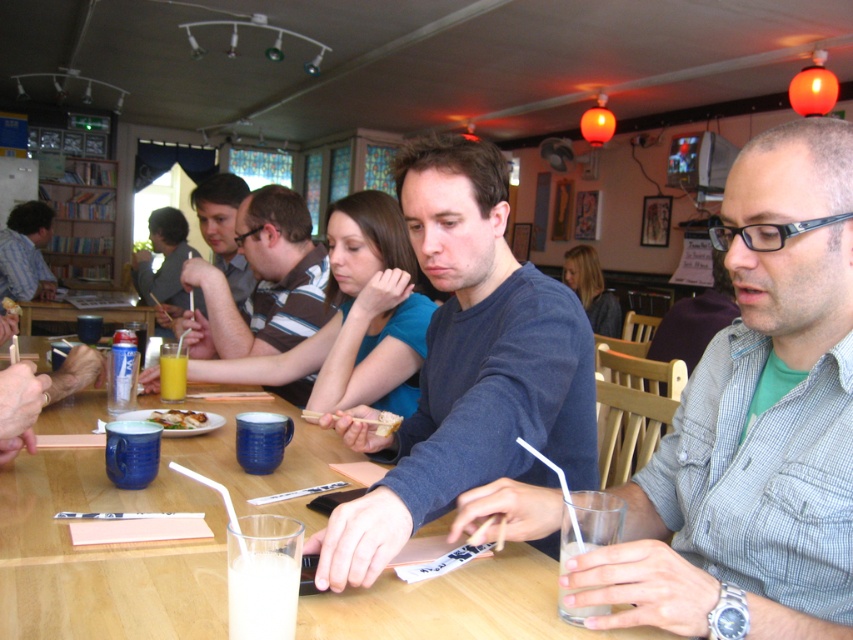
Question: Is wooden table at center closer to the viewer compared to yellow matte cup at center?

Choices:
 (A) yes
 (B) no

Answer: (A)

Question: Is matte black shirt at center smaller than golden fried fish at center?

Choices:
 (A) no
 (B) yes

Answer: (A)

Question: Which point is closer to the camera taking this photo?

Choices:
 (A) (21, 244)
 (B) (189, 413)

Answer: (B)

Question: Which of the following is the farthest from the observer?

Choices:
 (A) wooden table at center
 (B) milky white liquid at lower left

Answer: (A)

Question: Which point appears farthest from the camera in this image?

Choices:
 (A) (9, 216)
 (B) (231, 611)
 (C) (170, 376)
 (D) (184, 236)

Answer: (A)

Question: Is striped cotton shirt at center smaller than yellow matte cup at center?

Choices:
 (A) no
 (B) yes

Answer: (A)